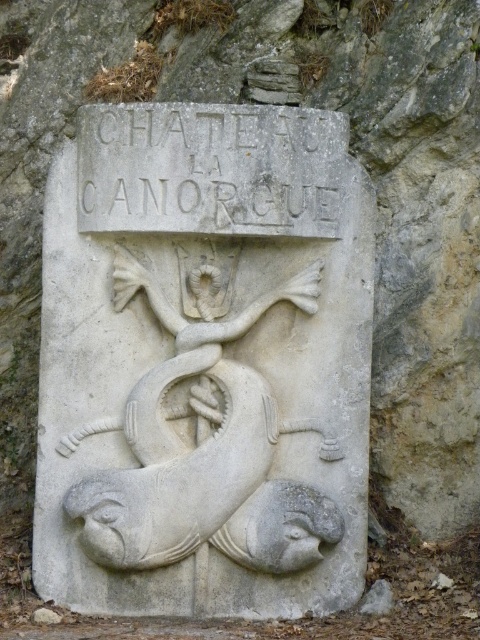
Question: Which object is farther from the camera taking this photo?

Choices:
 (A) white stone fish at center
 (B) white stone text at center

Answer: (B)

Question: Does white stone fish at center have a lesser width compared to white stone text at center?

Choices:
 (A) no
 (B) yes

Answer: (A)

Question: Can you confirm if white stone fish at center is thinner than white stone text at center?

Choices:
 (A) no
 (B) yes

Answer: (A)

Question: Is white stone fish at center above white stone text at center?

Choices:
 (A) yes
 (B) no

Answer: (B)

Question: Which point is closer to the camera?

Choices:
 (A) (325, 177)
 (B) (182, 524)

Answer: (B)

Question: Which of the following is the closest to the observer?

Choices:
 (A) (253, 192)
 (B) (220, 512)

Answer: (B)